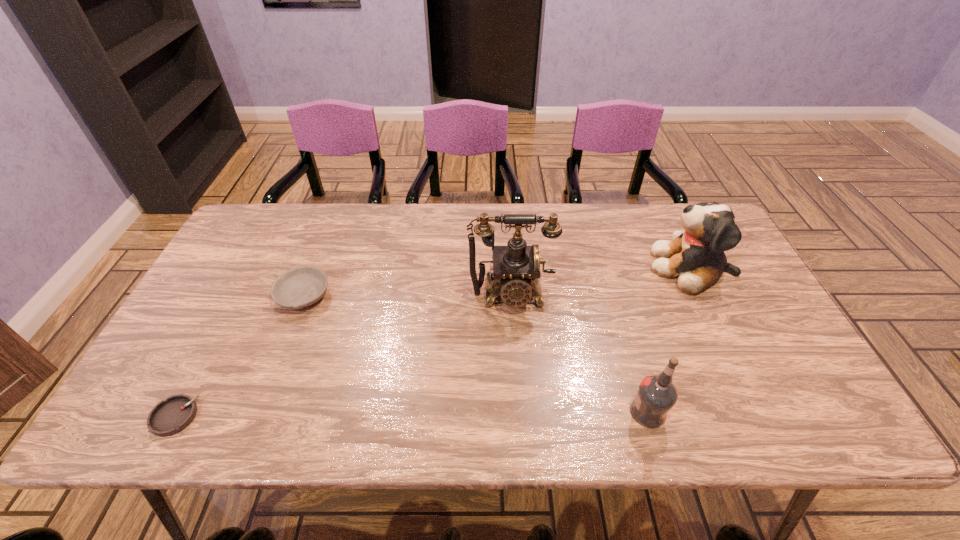
This screenshot has height=540, width=960. I want to click on object that ranks as the second closest to the shortest object, so click(x=516, y=267).

You are a GUI agent. You are given a task and a screenshot of the screen. Output one action in this format:
    pyautogui.click(x=<x>, y=<y>)
    Task: Click on the free space that satisfies the following two spatial constraints: 1. at the face of the rightmost object; 2. on the rotary dial of the telephone
    This screenshot has height=540, width=960.
    Given the screenshot: What is the action you would take?
    pyautogui.click(x=706, y=295)